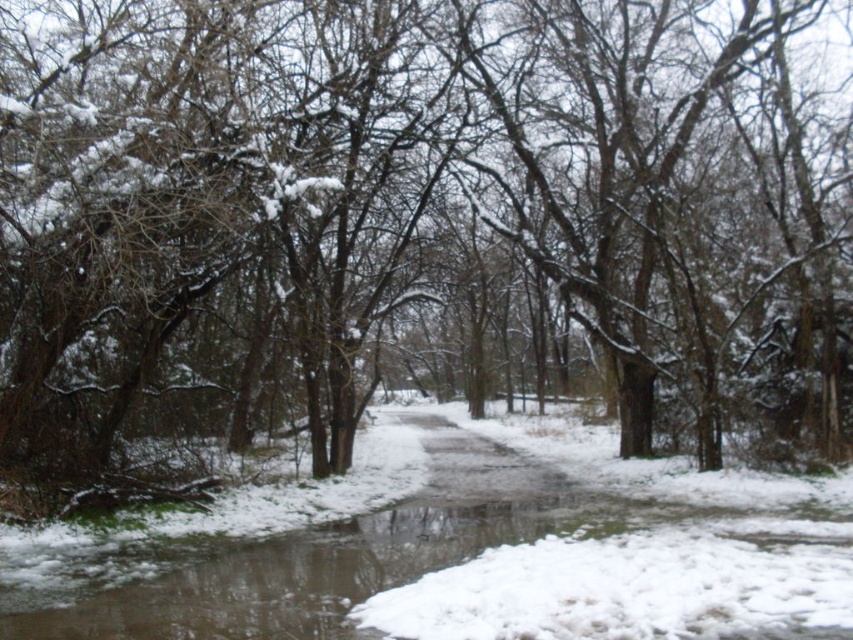
You are planning to cross the frozen water at center and the glossy asphalt path at center. Which one has a larger surface area for walking?

The frozen water at center is bigger than glossy asphalt path at center, so the frozen water at center has a larger surface area for walking.